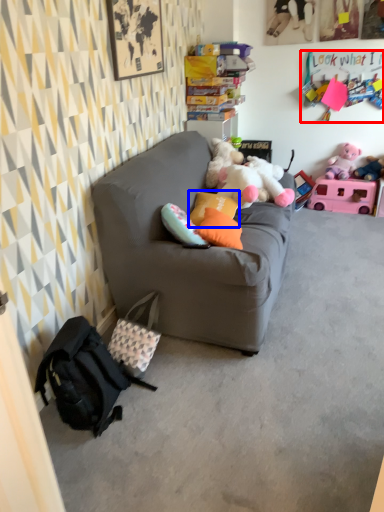
Question: Which of the following is the closest to the observer, toy (highlighted by a red box) or pillow (highlighted by a blue box)?

Choices:
 (A) toy
 (B) pillow

Answer: (B)